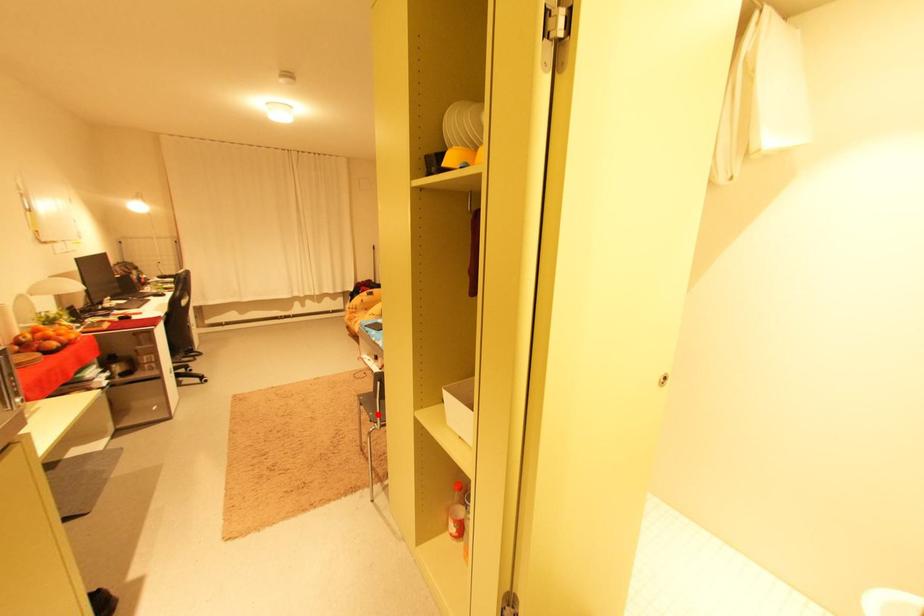
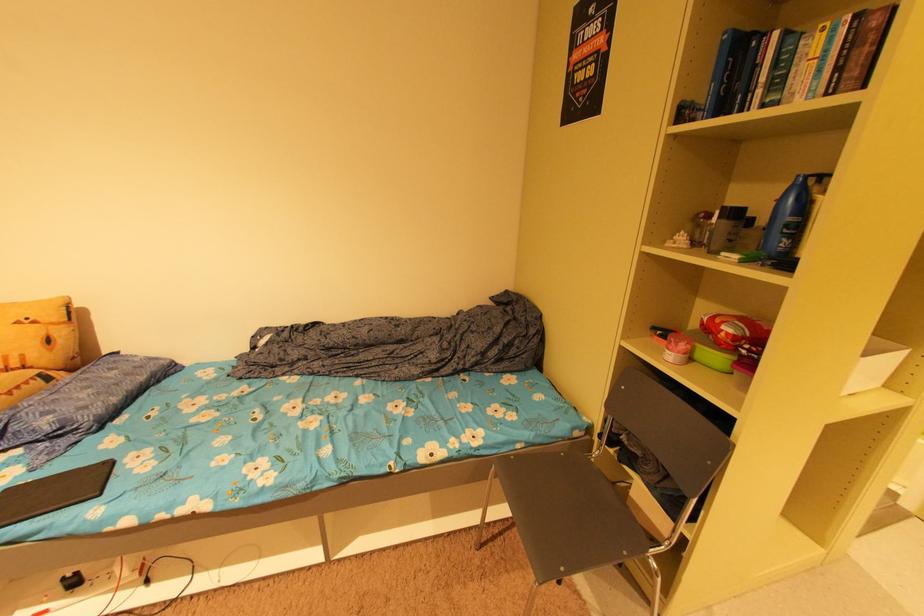
The point at the highlighted location is marked in the first image. Where is the corresponding point in the second image?

(633, 554)